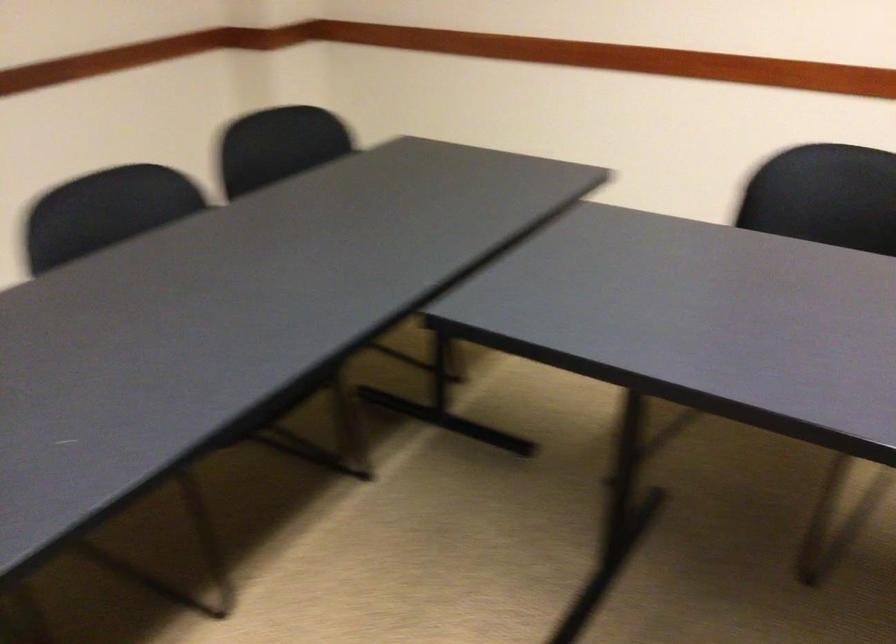
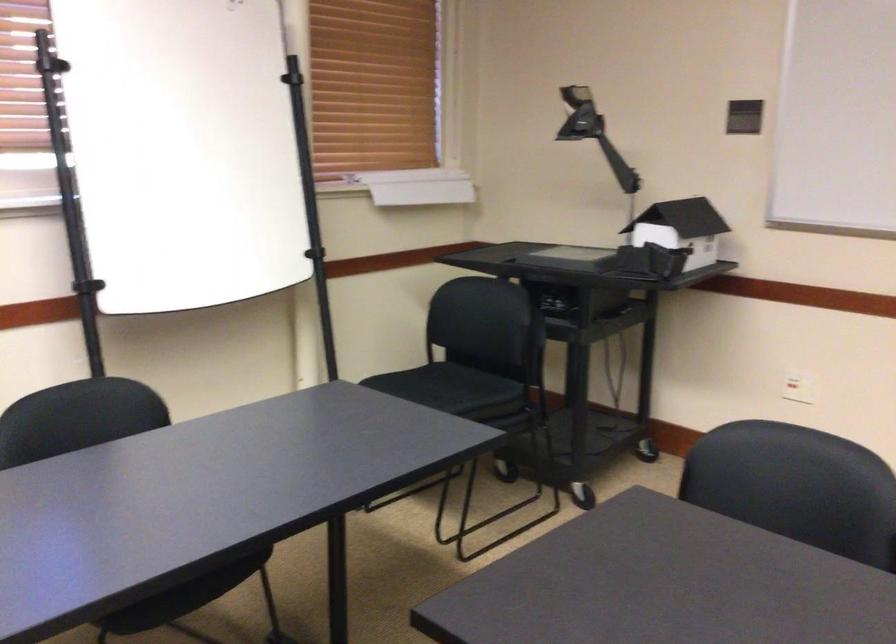
Question: The camera is either moving clockwise (left) or counter-clockwise (right) around the object. The first image is from the beginning of the video and the second image is from the end. Is the camera moving left or right when shooting the video?

Choices:
 (A) Left
 (B) Right

Answer: (A)